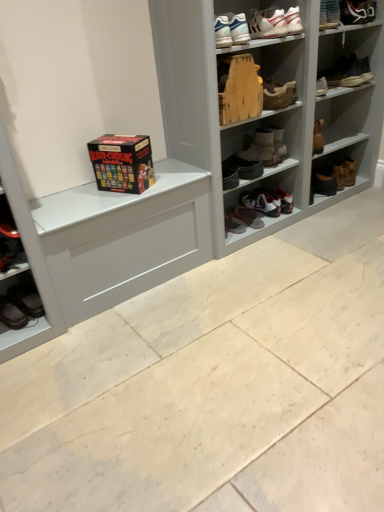
Locate an element on the screen. free space above black leather boots at center, the twelfth footwear in the right-to-left sequence (from a real-world perspective) is located at coordinates (238, 153).